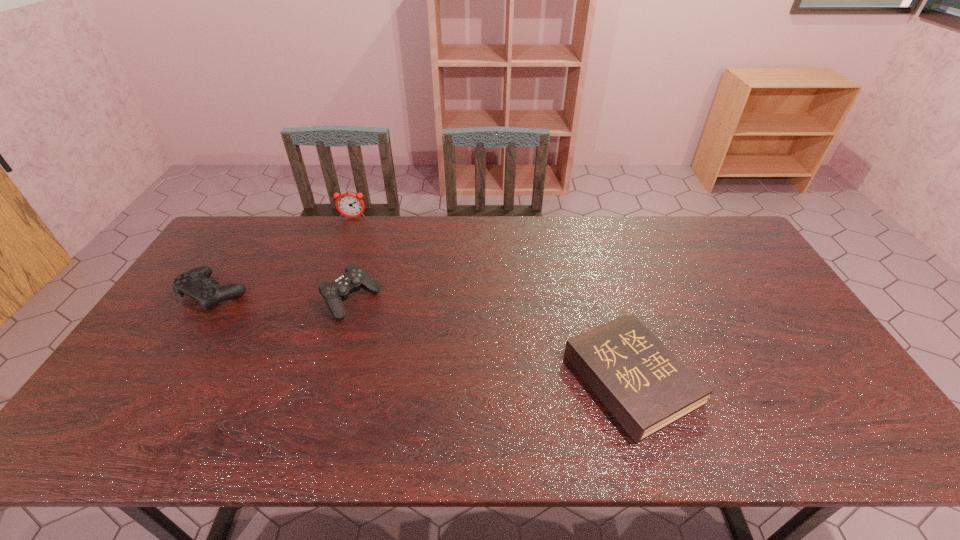
Locate an element on the screen. The width and height of the screenshot is (960, 540). the tallest object is located at coordinates (350, 205).

Where is `the farthest object`? The width and height of the screenshot is (960, 540). the farthest object is located at coordinates (350, 205).

Find the location of a particular element. The height and width of the screenshot is (540, 960). the right control is located at coordinates (355, 277).

This screenshot has width=960, height=540. I want to click on the leftmost object, so click(195, 283).

Where is `hardback book`? The height and width of the screenshot is (540, 960). hardback book is located at coordinates click(646, 387).

Locate an element on the screen. This screenshot has height=540, width=960. the nearest object is located at coordinates (646, 387).

At what (x,y) coordinates should I click in order to perform the action: click on free space located on the front-facing side of the alarm clock. Please return your answer as a coordinate pair (x, y). This screenshot has height=540, width=960. Looking at the image, I should click on (344, 243).

The width and height of the screenshot is (960, 540). I want to click on vacant point located on the back of the right control, so click(x=368, y=246).

The image size is (960, 540). Identify the location of vacant space located on the front of the leftmost object. (128, 430).

Find the location of a particular element. Image resolution: width=960 pixels, height=540 pixels. vacant space located 0.160m on the left of the rightmost object is located at coordinates (505, 379).